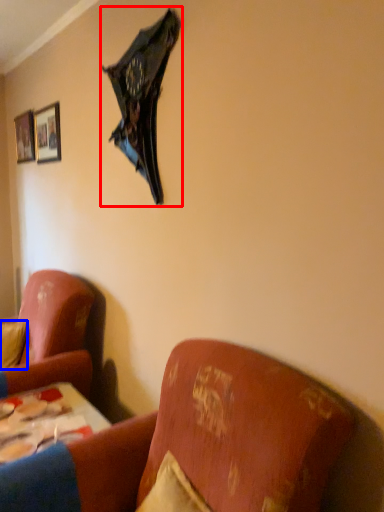
Question: Which object is further to the camera taking this photo, umbrella (highlighted by a red box) or pillow (highlighted by a blue box)?

Choices:
 (A) umbrella
 (B) pillow

Answer: (B)